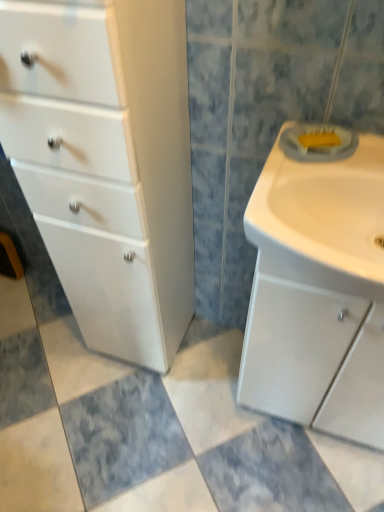
Question: Is white glossy sink at right positioned behind white glossy cabinet at left?

Choices:
 (A) yes
 (B) no

Answer: (A)

Question: Does white glossy sink at right appear on the right side of white glossy cabinet at left?

Choices:
 (A) yes
 (B) no

Answer: (A)

Question: Is white glossy sink at right next to white glossy cabinet at left and touching it?

Choices:
 (A) no
 (B) yes

Answer: (A)

Question: From the image's perspective, is white glossy sink at right located beneath white glossy cabinet at left?

Choices:
 (A) no
 (B) yes

Answer: (A)

Question: Is white glossy sink at right not within white glossy cabinet at left?

Choices:
 (A) no
 (B) yes

Answer: (B)

Question: From a real-world perspective, is white glossy sink at right located higher than white glossy cabinet at left?

Choices:
 (A) no
 (B) yes

Answer: (B)

Question: Is white matte sink cabinet at right taller than white glossy sink at right?

Choices:
 (A) yes
 (B) no

Answer: (A)

Question: From a real-world perspective, is white matte sink cabinet at right physically above white glossy sink at right?

Choices:
 (A) no
 (B) yes

Answer: (A)

Question: Does white matte sink cabinet at right have a greater width compared to white glossy sink at right?

Choices:
 (A) no
 (B) yes

Answer: (A)

Question: Considering the relative sizes of white matte sink cabinet at right and white glossy sink at right in the image provided, is white matte sink cabinet at right bigger than white glossy sink at right?

Choices:
 (A) yes
 (B) no

Answer: (A)

Question: Can you confirm if white matte sink cabinet at right is smaller than white glossy sink at right?

Choices:
 (A) yes
 (B) no

Answer: (B)

Question: Is white matte sink cabinet at right oriented towards white glossy sink at right?

Choices:
 (A) no
 (B) yes

Answer: (A)

Question: Is white glossy cabinet at left further to the viewer compared to white glossy sink at right?

Choices:
 (A) yes
 (B) no

Answer: (B)